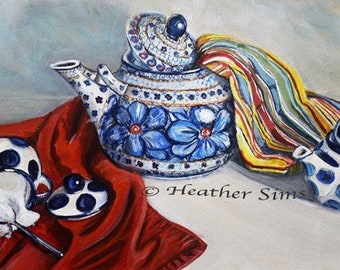
Where is `turned over cup of sugar`? The width and height of the screenshot is (340, 270). turned over cup of sugar is located at coordinates (20, 197).